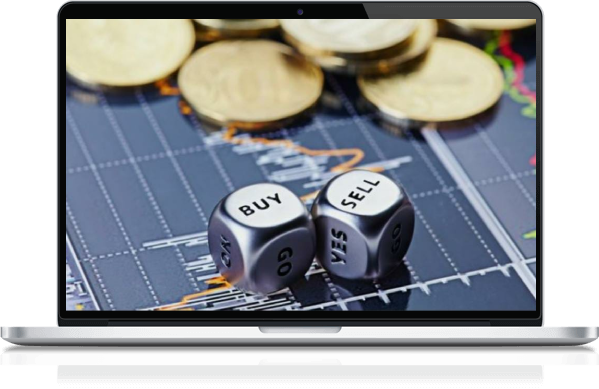
Find the location of a particular element. Image resolution: width=599 pixels, height=389 pixels. silver base of screen is located at coordinates (225, 330).